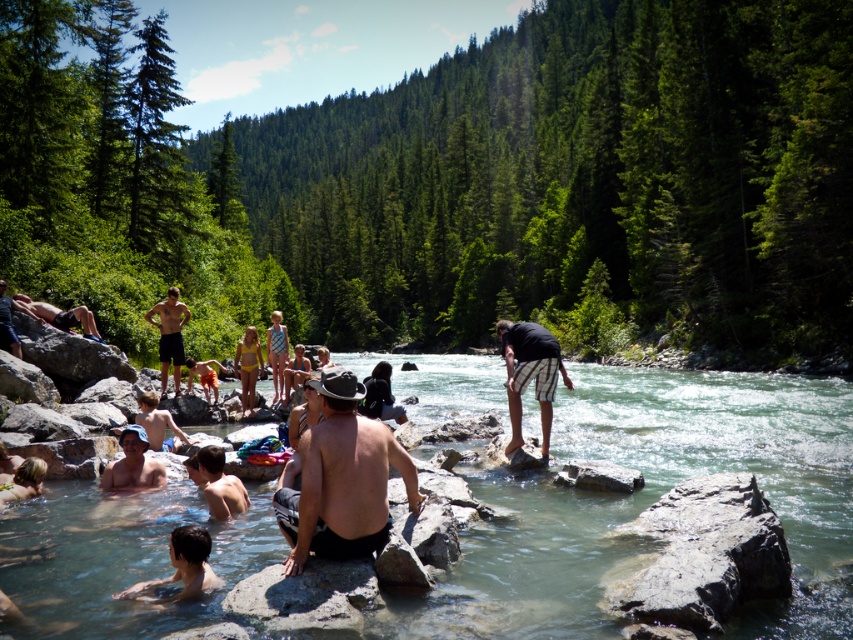
Question: Can you confirm if clear water at center is positioned to the right of smooth skin boy at lower center?

Choices:
 (A) no
 (B) yes

Answer: (B)

Question: Which object is closer to the camera taking this photo?

Choices:
 (A) clear water at center
 (B) smooth skin boy at lower center
 (C) shiny metallic hat at center

Answer: (A)

Question: Among these points, which one is nearest to the camera?

Choices:
 (A) (155, 410)
 (B) (218, 561)

Answer: (B)

Question: Does shiny metallic hat at center appear on the right side of black striped shorts at center?

Choices:
 (A) no
 (B) yes

Answer: (A)

Question: Can you confirm if black striped shorts at center is positioned to the left of black matte shorts at upper left?

Choices:
 (A) yes
 (B) no

Answer: (B)

Question: Which of the following is the closest to the observer?

Choices:
 (A) smooth skin boy at lower center
 (B) smooth skin man at lower left
 (C) smooth skin man at left

Answer: (B)